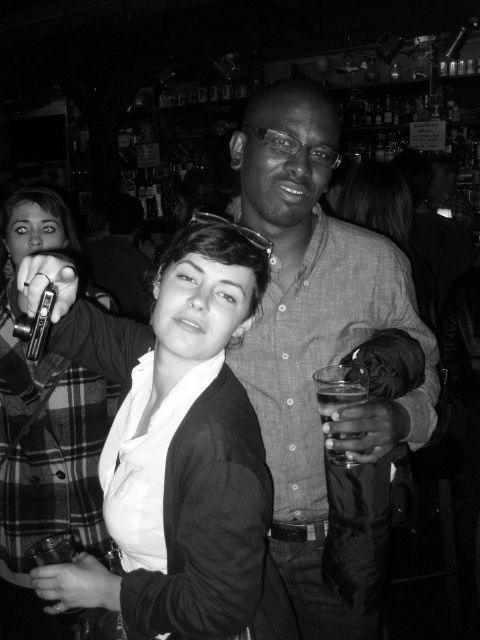
Is matte black jacket at center further to the viewer compared to matte black blazer at center?

No, matte black jacket at center is in front of matte black blazer at center.

Does matte black jacket at center appear on the right side of matte black blazer at center?

In fact, matte black jacket at center is to the left of matte black blazer at center.

Which is in front, point (232, 497) or point (356, 188)?

Point (232, 497) is more forward.

Image resolution: width=480 pixels, height=640 pixels. I want to click on matte black jacket at center, so click(175, 448).

Can you confirm if matte black blazer at center is shorter than clear glass at right?

No, matte black blazer at center is not shorter than clear glass at right.

Which is in front, point (388, 212) or point (334, 452)?

Point (334, 452)

The image size is (480, 640). Describe the element at coordinates (387, 221) in the screenshot. I see `matte black blazer at center` at that location.

You are a GUI agent. You are given a task and a screenshot of the screen. Output one action in this format:
    pyautogui.click(x=<x>, y=<y>)
    Task: Click on the matte black blazer at center
    The width and height of the screenshot is (480, 640).
    Given the screenshot: What is the action you would take?
    pyautogui.click(x=387, y=221)

What do you see at coordinates (45, 470) in the screenshot? The width and height of the screenshot is (480, 640). I see `plaid fabric jacket at left` at bounding box center [45, 470].

Can you confirm if plaid fabric jacket at left is positioned above clear glass at right?

Incorrect, plaid fabric jacket at left is not positioned above clear glass at right.

Does point (41, 426) come behind point (325, 381)?

Yes, point (41, 426) is farther from viewer.

You are a GUI agent. You are given a task and a screenshot of the screen. Output one action in this format:
    pyautogui.click(x=<x>, y=<y>)
    Task: Click on the plaid fabric jacket at left
    The image size is (480, 640).
    Given the screenshot: What is the action you would take?
    [x=45, y=470]